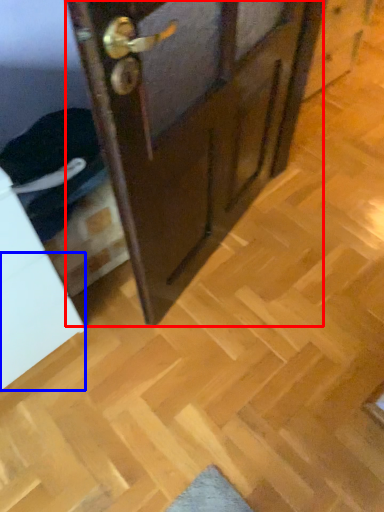
Question: Among these objects, which one is farthest to the camera, door (highlighted by a red box) or drawer (highlighted by a blue box)?

Choices:
 (A) door
 (B) drawer

Answer: (B)